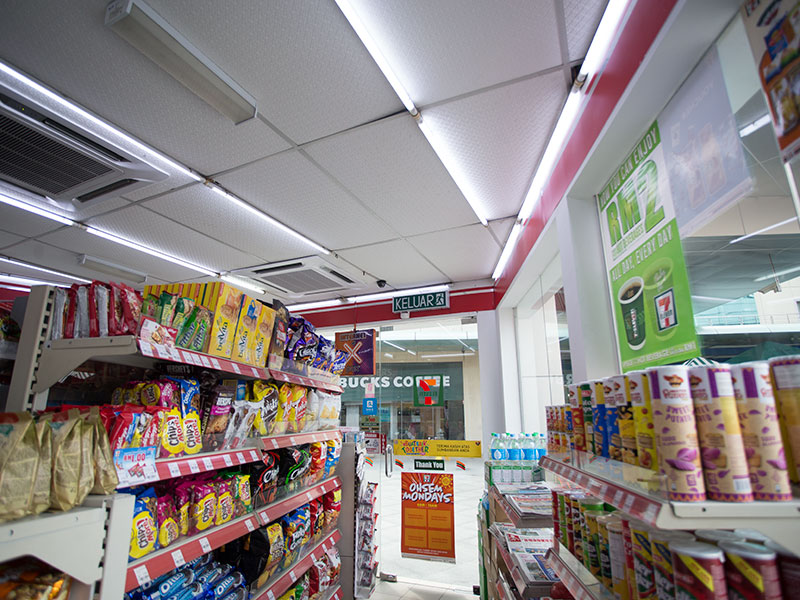
Locate an element on the screen. The width and height of the screenshot is (800, 600). door handle is located at coordinates (382, 457).